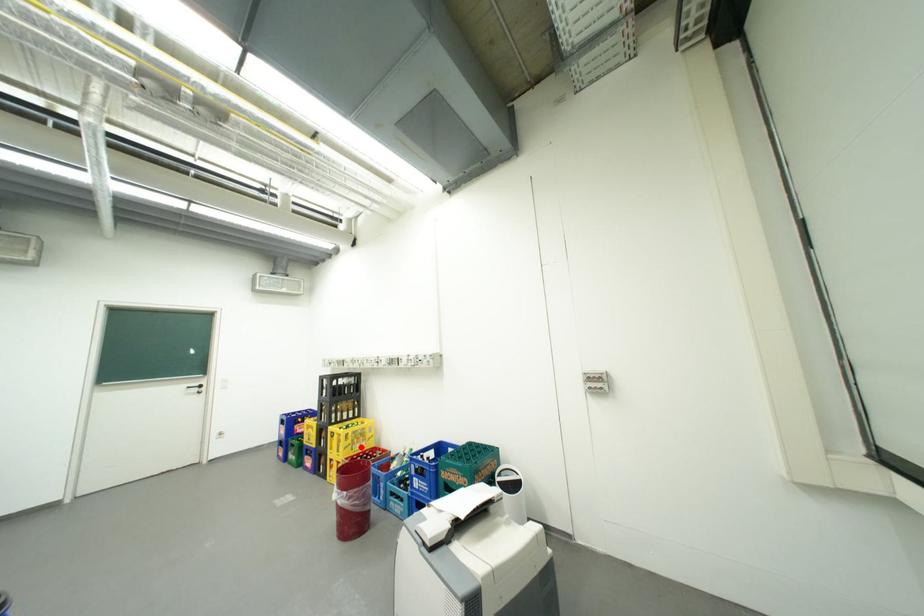
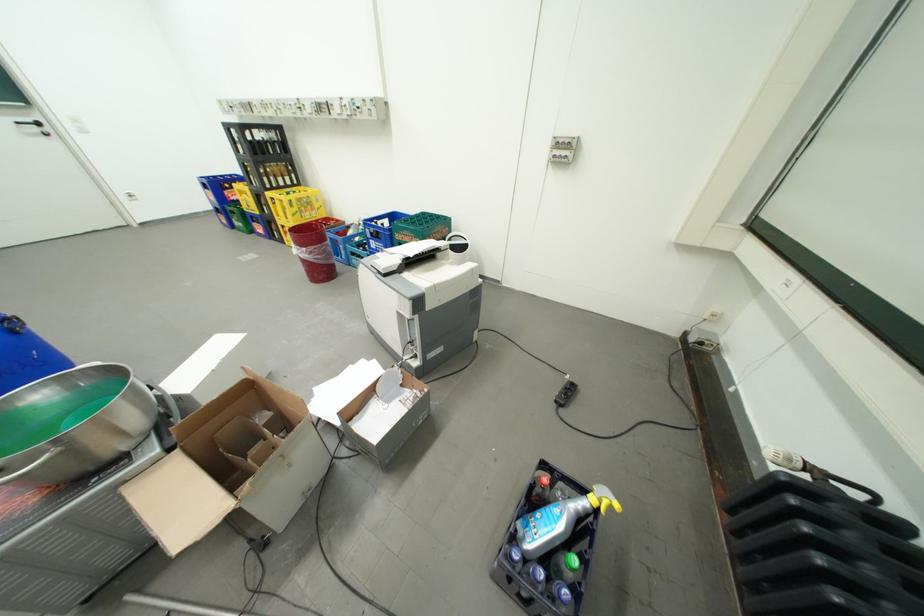
Question: I am providing you with two images of the same scene from different viewpoints. In image1, a red point is highlighted. Considering the same 3D point in image2, which of the following is correct?

Choices:
 (A) It is closer
 (B) It is farther

Answer: (A)